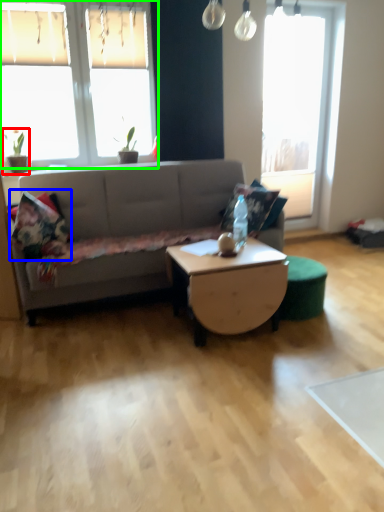
Question: Which object is the closest to the houseplant (highlighted by a red box)? Choose among these: pillow (highlighted by a blue box) or window (highlighted by a green box).

Choices:
 (A) pillow
 (B) window

Answer: (B)